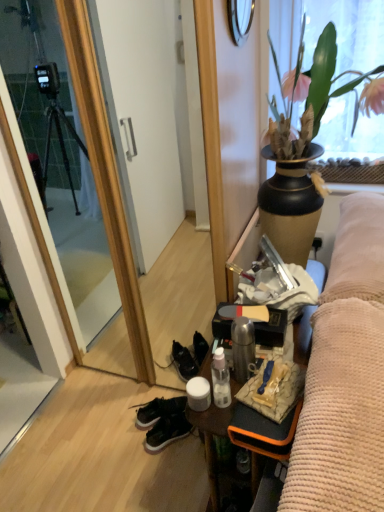
Question: Does black leather sneakers at lower center lie behind black suede sneakers at lower center?

Choices:
 (A) yes
 (B) no

Answer: (A)

Question: From a real-world perspective, is black leather sneakers at lower center under black suede sneakers at lower center?

Choices:
 (A) yes
 (B) no

Answer: (A)

Question: From a real-world perspective, is black leather sneakers at lower center physically above black suede sneakers at lower center?

Choices:
 (A) no
 (B) yes

Answer: (A)

Question: Considering the relative sizes of black leather sneakers at lower center and black suede sneakers at lower center in the image provided, is black leather sneakers at lower center smaller than black suede sneakers at lower center?

Choices:
 (A) no
 (B) yes

Answer: (A)

Question: Is black leather sneakers at lower center turned away from black suede sneakers at lower center?

Choices:
 (A) no
 (B) yes

Answer: (A)

Question: From the image's perspective, would you say black leather sneakers at lower center is positioned over black suede sneakers at lower center?

Choices:
 (A) no
 (B) yes

Answer: (B)

Question: Can we say black suede sneakers at lower center lies outside metallic silver desk at center?

Choices:
 (A) yes
 (B) no

Answer: (A)

Question: Is black suede sneakers at lower center aimed at metallic silver desk at center?

Choices:
 (A) yes
 (B) no

Answer: (B)

Question: Is black suede sneakers at lower center oriented away from metallic silver desk at center?

Choices:
 (A) yes
 (B) no

Answer: (B)

Question: From the image's perspective, is black suede sneakers at lower center located beneath metallic silver desk at center?

Choices:
 (A) yes
 (B) no

Answer: (A)

Question: Considering the relative positions of black suede sneakers at lower center and metallic silver desk at center in the image provided, is black suede sneakers at lower center to the right of metallic silver desk at center from the viewer's perspective?

Choices:
 (A) yes
 (B) no

Answer: (B)

Question: Does black suede sneakers at lower center have a lesser height compared to metallic silver desk at center?

Choices:
 (A) no
 (B) yes

Answer: (B)

Question: Is matte black vase with plant at upper right next to black leather sneakers at lower center and touching it?

Choices:
 (A) yes
 (B) no

Answer: (B)